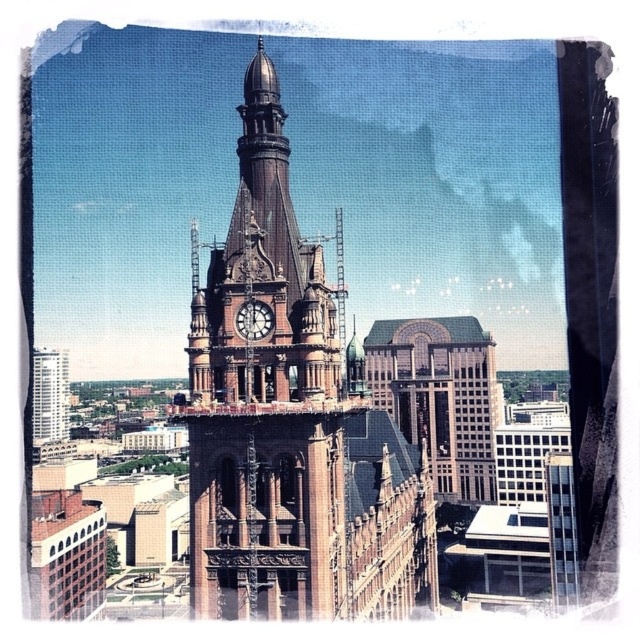
You are an architect examining the historic clock tower. You notice the brick building at center and the polished brass clock at center. Which object is closer to your current position?

The brick building at center is closer to you than the polished brass clock at center because it is further to the viewer, meaning it appears nearer in the visual perspective.

You are standing in the city square and see the brown brick clock tower at center and the brick building at center. Which one is positioned more to the left side?

The brown brick clock tower at center is positioned more to the left side than the brick building at center.

You are an architect reviewing blueprints for a new city plaza. The design includes a brick building at center and a polished brass clock at center. Based on the image, which structure would require a taller foundation to accommodate its height?

The brick building at center is taller than the polished brass clock at center, so the brick building at center would require a taller foundation to accommodate its height.